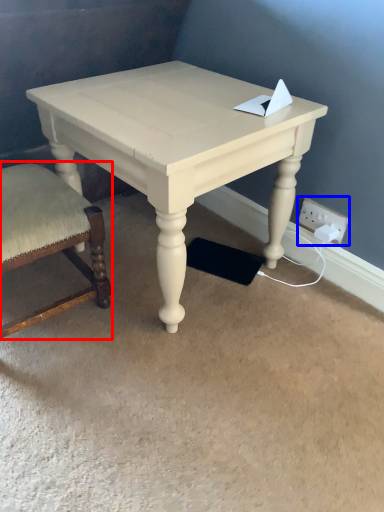
Question: Which point is further to the camera, chair (highlighted by a red box) or electric outlet (highlighted by a blue box)?

Choices:
 (A) chair
 (B) electric outlet

Answer: (B)